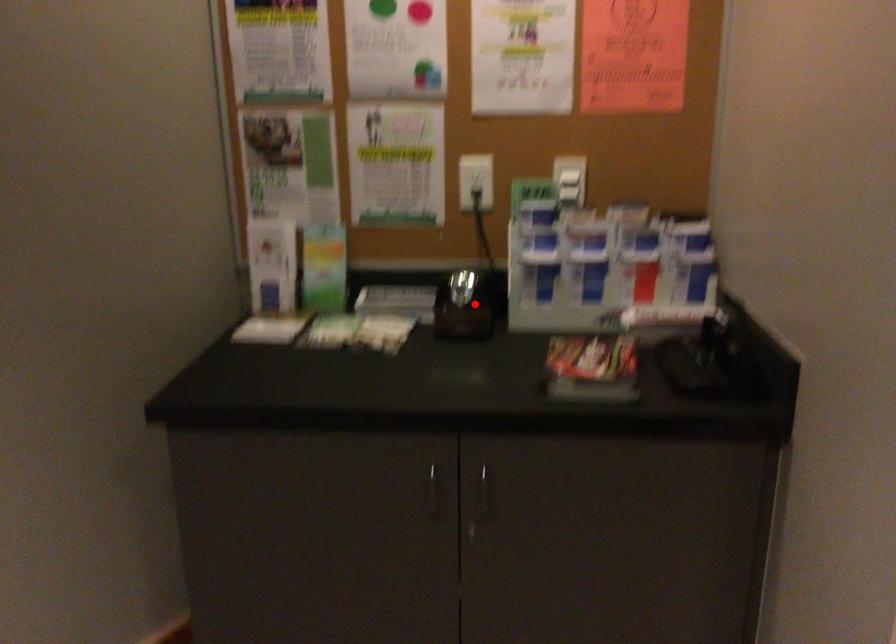
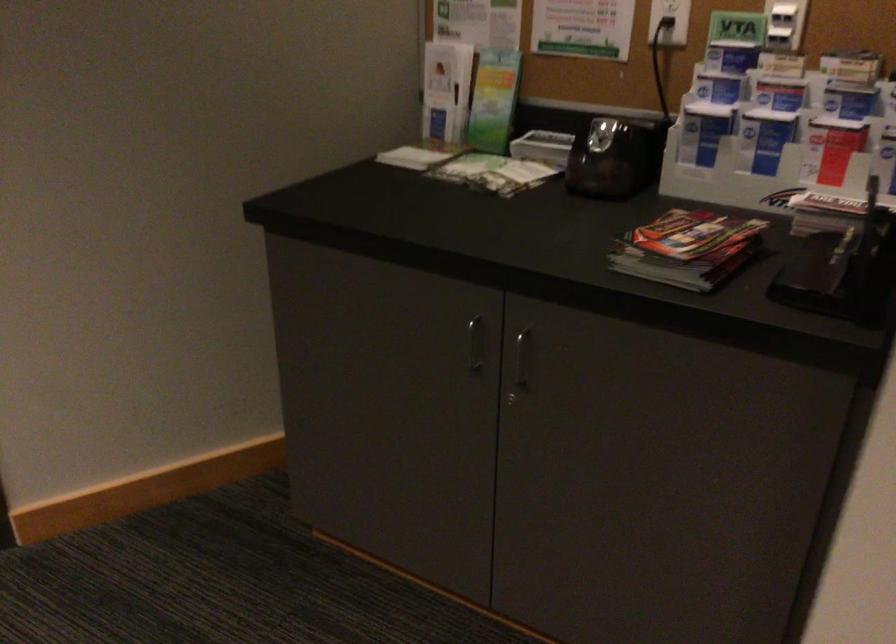
Find the pixel in the second image that matches the highlighted location in the first image.

(613, 158)